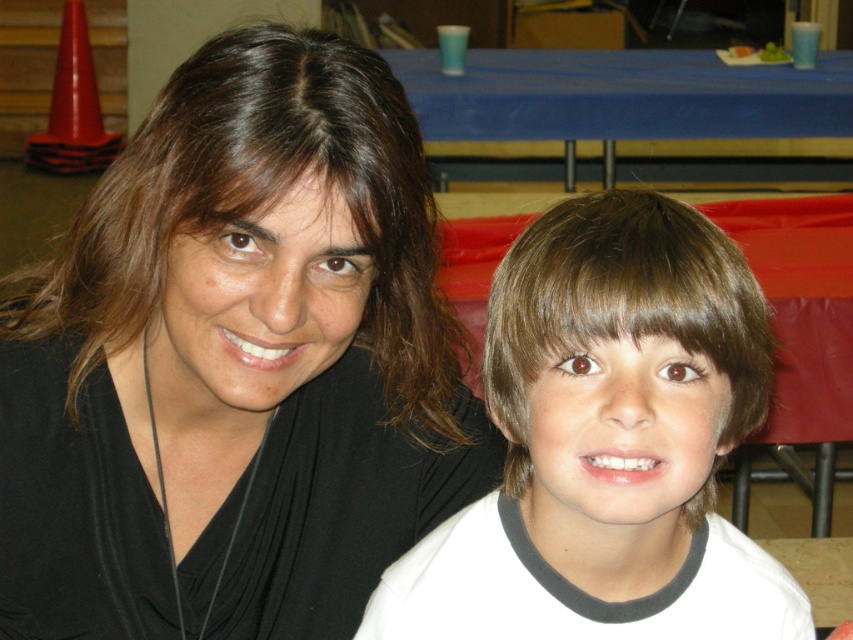
Can you confirm if black matte hair at upper left is wider than brown hair at center?

Yes, black matte hair at upper left is wider than brown hair at center.

Locate an element on the screen. black matte hair at upper left is located at coordinates (236, 362).

Identify the location of black matte hair at upper left. This screenshot has width=853, height=640. pos(236,362).